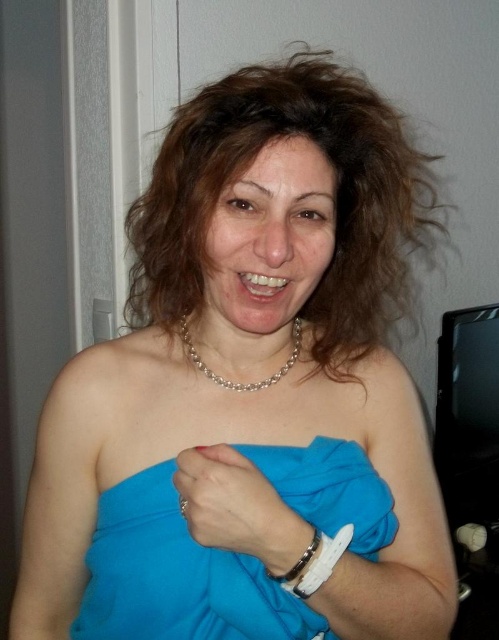
You are a photographer setting up a shoot in this room. You need to position a light source to the right of the subject to highlight their jewelry. Given the current arrangement, will the light hit the silver metallic bracelet at wrist before it reaches the brown curly hair at upper center?

The brown curly hair at upper center is to the left of the silver metallic bracelet at wrist, so the light positioned to the right of the subject would hit the silver metallic bracelet at wrist first before reaching the brown curly hair at upper center.

You are a fashion designer measuring the distance between the brown curly hair at upper center and the silver metallic bracelet at wrist for a new accessory line. Is the distance sufficient to accommodate a necklace that requires at least 15 inches of space between them?

The brown curly hair at upper center is 14.93 inches away from the silver metallic bracelet at wrist. Since the required space is 15 inches, the distance is insufficient to accommodate the necklace.